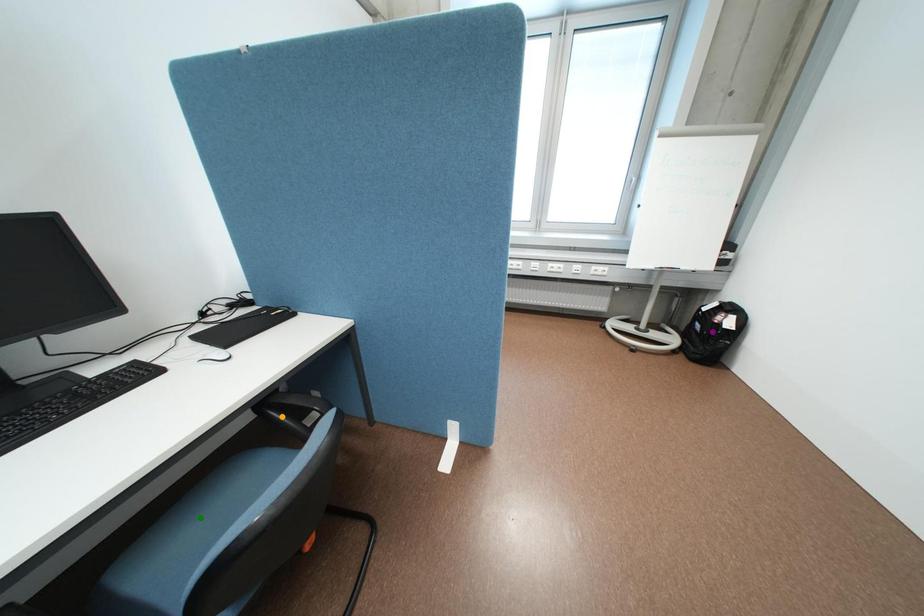
Order these from nearest to farthest:
1. orange point
2. purple point
3. green point

green point < orange point < purple point